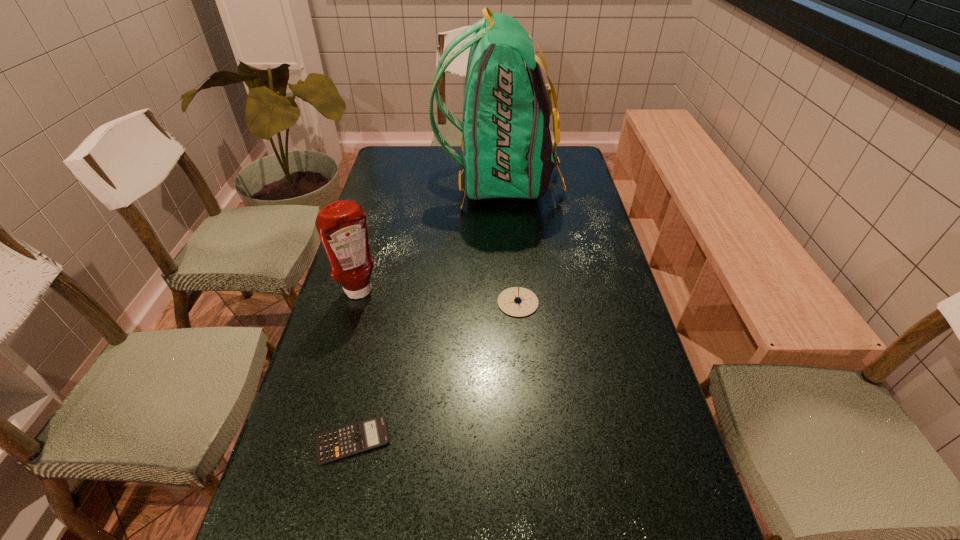
Locate an element on the screen. The image size is (960, 540). vacant area situated on the left of the third tallest object is located at coordinates (461, 302).

Identify the location of blank space located 0.340m on the right of the calculator. The width and height of the screenshot is (960, 540). (556, 440).

Identify the location of object present at the far edge. (507, 148).

Find the location of a particular element. This screenshot has height=540, width=960. condiment that is at the left edge is located at coordinates (341, 225).

The image size is (960, 540). Identify the location of calculator at the left edge. (339, 443).

Where is `object that is at the right edge`? The width and height of the screenshot is (960, 540). object that is at the right edge is located at coordinates (507, 148).

At what (x,y) coordinates should I click in order to perform the action: click on object present at the far right corner. Please return your answer as a coordinate pair (x, y). This screenshot has height=540, width=960. Looking at the image, I should click on click(x=507, y=148).

Where is `free space at the left edge`? The height and width of the screenshot is (540, 960). free space at the left edge is located at coordinates (378, 246).

In order to click on free space at the right edge of the desktop in this screenshot , I will do `click(610, 333)`.

You are a GUI agent. You are given a task and a screenshot of the screen. Output one action in this format:
    pyautogui.click(x=<x>, y=<y>)
    Task: Click on the vacant space at the far left corner of the desktop
    
    Given the screenshot: What is the action you would take?
    pyautogui.click(x=380, y=164)